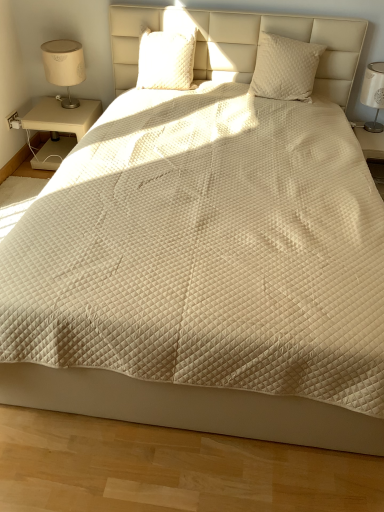
Question: Considering the relative positions of white quilted fabric at right and white quilted pillow at upper right, which is counted as the 1th pillow, starting from the right, in the image provided, is white quilted fabric at right to the right of white quilted pillow at upper right, which is counted as the 1th pillow, starting from the right, from the viewer's perspective?

Choices:
 (A) yes
 (B) no

Answer: (A)

Question: From a real-world perspective, is white quilted fabric at right physically below white quilted pillow at upper right, the 2th pillow positioned from the left?

Choices:
 (A) no
 (B) yes

Answer: (B)

Question: Does white quilted fabric at right have a lesser width compared to white quilted pillow at upper right, which is counted as the 1th pillow, starting from the right?

Choices:
 (A) yes
 (B) no

Answer: (B)

Question: Is white quilted fabric at right in contact with white quilted pillow at upper right, the 2th pillow positioned from the left?

Choices:
 (A) no
 (B) yes

Answer: (A)

Question: Does white quilted fabric at right appear on the left side of white quilted pillow at upper right, which is counted as the 1th pillow, starting from the right?

Choices:
 (A) yes
 (B) no

Answer: (B)

Question: Based on their sizes in the image, would you say quilted cream pillow at upper center, the second pillow from the right, is bigger or smaller than white quilted fabric at right?

Choices:
 (A) small
 (B) big

Answer: (A)

Question: Considering the positions of point (160, 72) and point (380, 186), is point (160, 72) closer or farther from the camera than point (380, 186)?

Choices:
 (A) farther
 (B) closer

Answer: (A)

Question: From a real-world perspective, is quilted cream pillow at upper center, placed as the 1th pillow when sorted from left to right, positioned above or below white quilted fabric at right?

Choices:
 (A) below
 (B) above

Answer: (B)

Question: From the image's perspective, is quilted cream pillow at upper center, placed as the 1th pillow when sorted from left to right, positioned above or below white quilted fabric at right?

Choices:
 (A) above
 (B) below

Answer: (A)

Question: Considering their positions, is beige fabric lampshade at left located in front of or behind beige wood nightstand at left?

Choices:
 (A) front
 (B) behind

Answer: (A)

Question: Is beige fabric lampshade at left taller or shorter than beige wood nightstand at left?

Choices:
 (A) short
 (B) tall

Answer: (B)

Question: Is beige fabric lampshade at left spatially inside beige wood nightstand at left, or outside of it?

Choices:
 (A) inside
 (B) outside

Answer: (B)

Question: In terms of width, does beige fabric lampshade at left look wider or thinner when compared to beige wood nightstand at left?

Choices:
 (A) wide
 (B) thin

Answer: (B)

Question: Based on their positions, is white quilted fabric at right located to the left or right of quilted cream pillow at upper center, placed as the 1th pillow when sorted from left to right?

Choices:
 (A) right
 (B) left

Answer: (A)

Question: Considering the positions of point (382, 156) and point (172, 40), is point (382, 156) closer or farther from the camera than point (172, 40)?

Choices:
 (A) closer
 (B) farther

Answer: (B)